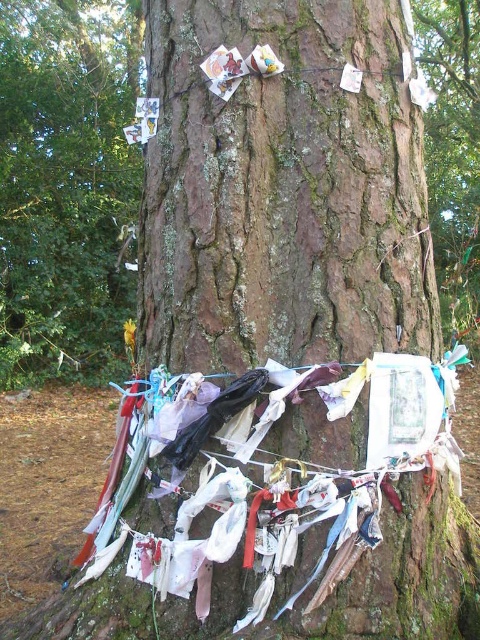
You are an artist planning to paint the tree in the image. You need to decide which part of the tree to focus on first based on their sizes. Which object should you paint first, the brown rough bark at center or the rough bark tree at upper center?

The brown rough bark at center is shorter than the rough bark tree at upper center, so you should paint the rough bark tree at upper center first since it is taller and likely more prominent in the composition.

You are standing in front of the tree and want to place a new decoration. You have two options to choose from. One is to hang it at point (398, 540) and the other is at point (108, 323). Which point is closer to you?

Point (398, 540) is closer to the viewer than point (108, 323).

Consider the image. You are an artist observing the tree with its decorations. You notice two areas of the tree trunk labeled as brown rough bark at center and rough bark tree at upper center. Which area is more to the right?

The brown rough bark at center is positioned on the right side of rough bark tree at upper center, so the brown rough bark at center is more to the right.